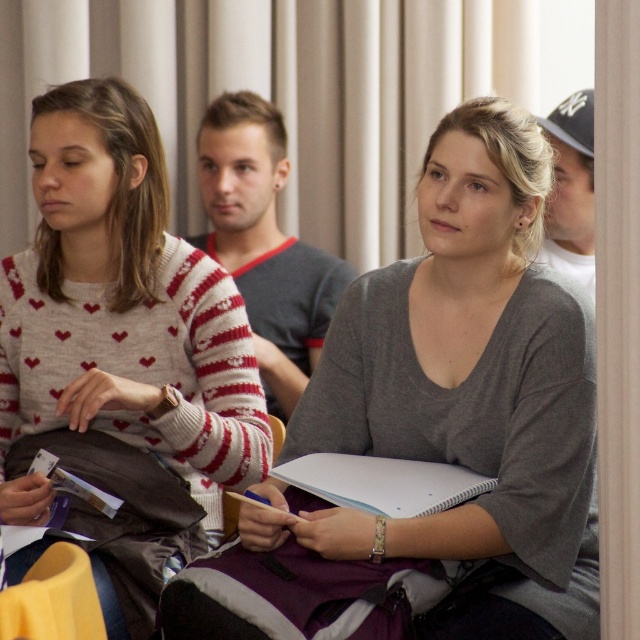
Which is more to the left, white paper notebook at center or white cotton cap at upper right?

From the viewer's perspective, white paper notebook at center appears more on the left side.

Between white paper notebook at center and white cotton cap at upper right, which one is positioned higher?

white cotton cap at upper right is higher up.

The image size is (640, 640). What are the coordinates of `white paper notebook at center` in the screenshot? It's located at (381, 483).

Is point (371, 301) closer to viewer compared to point (12, 499)?

That is False.

Locate an element on the screen. gray matte sweater at center is located at coordinates (438, 424).

Where is `gray matte sweater at center`? Image resolution: width=640 pixels, height=640 pixels. gray matte sweater at center is located at coordinates (438, 424).

Does knitted sweater at left have a greater height compared to white cotton cap at upper right?

Correct, knitted sweater at left is much taller as white cotton cap at upper right.

In the scene shown: Does knitted sweater at left appear on the right side of white cotton cap at upper right?

Incorrect, knitted sweater at left is not on the right side of white cotton cap at upper right.

Between point (268, 454) and point (589, 100), which one is positioned in front?

Point (268, 454) is more forward.

Locate an element on the screen. This screenshot has width=640, height=640. knitted sweater at left is located at coordinates (122, 316).